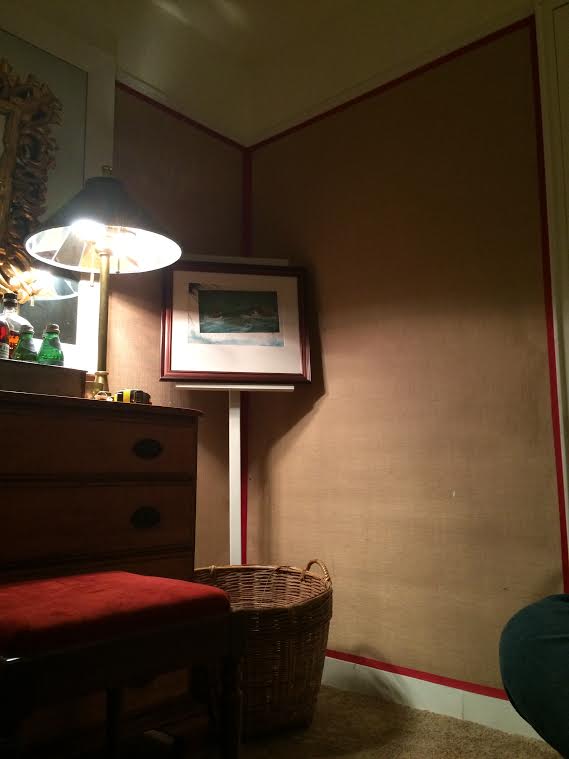
I want to click on brown wall, so click(394, 417).